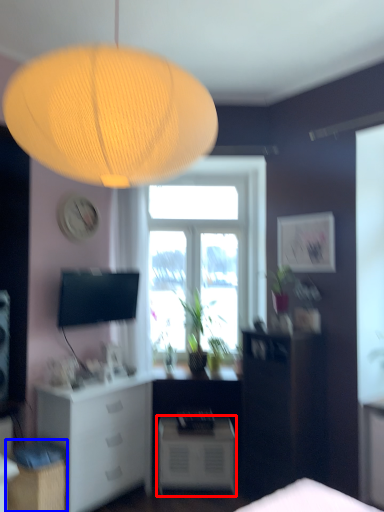
Question: Which point is further to the camera, nightstand (highlighted by a red box) or cabinetry (highlighted by a blue box)?

Choices:
 (A) nightstand
 (B) cabinetry

Answer: (A)